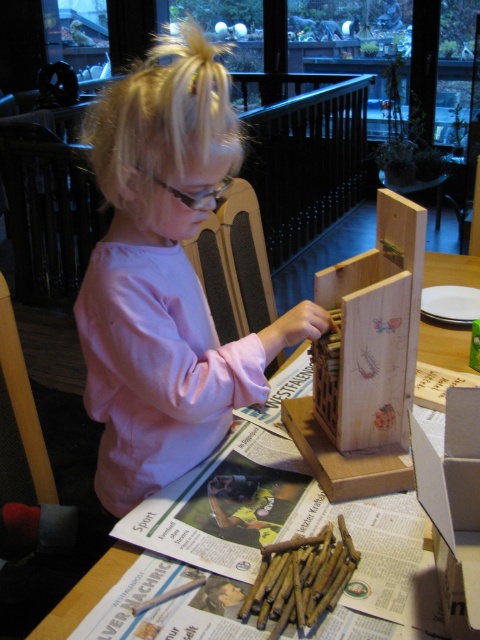
You are a parent trying to organize your childroom. You have a wooden box at center and a wooden table at center. Which one has a smaller width?

A: The wooden box at center is thinner than wooden table at center, so the wooden box at center has a smaller width.

From the picture: You are a teacher observing a child working on a craft project at a table. The child has wooden pencils at center. If you want to hand them a ruler that is 12 inches long, can you place it between you and the pencils without it overlapping?

The distance between the wooden pencils at center and the viewer is 29.08 inches. Since the ruler is only 12 inches long, placing it between you and the pencils would leave enough space, so yes, it can be placed without overlapping.

The child is working on a craft project at the wooden table at center. They need to reach for the wooden pencils at center. Are the pencils within easy reach on the table?

The wooden pencils at center are positioned under the wooden table at center, so they are not on the table surface. The child would need to reach under the table to get them.